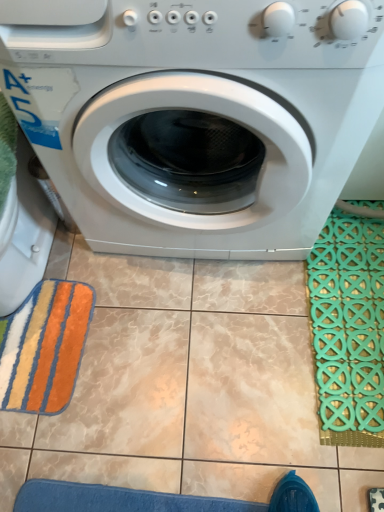
Question: Is multicolored plush bath towel at lower left further to the viewer compared to white glossy washing machine at center?

Choices:
 (A) yes
 (B) no

Answer: (A)

Question: From a real-world perspective, is multicolored plush bath towel at lower left on white glossy washing machine at center?

Choices:
 (A) yes
 (B) no

Answer: (B)

Question: Can you confirm if multicolored plush bath towel at lower left is shorter than white glossy washing machine at center?

Choices:
 (A) no
 (B) yes

Answer: (B)

Question: Considering the relative sizes of multicolored plush bath towel at lower left and white glossy washing machine at center in the image provided, is multicolored plush bath towel at lower left wider than white glossy washing machine at center?

Choices:
 (A) no
 (B) yes

Answer: (A)

Question: Considering the relative sizes of multicolored plush bath towel at lower left and white glossy washing machine at center in the image provided, is multicolored plush bath towel at lower left bigger than white glossy washing machine at center?

Choices:
 (A) yes
 (B) no

Answer: (B)

Question: Is point (49, 280) closer or farther from the camera than point (382, 293)?

Choices:
 (A) farther
 (B) closer

Answer: (A)

Question: Is multicolored plush bath towel at lower left inside or outside of green rubber bath mat at right?

Choices:
 (A) outside
 (B) inside

Answer: (A)

Question: Looking at their shapes, would you say multicolored plush bath towel at lower left is wider or thinner than green rubber bath mat at right?

Choices:
 (A) wide
 (B) thin

Answer: (A)

Question: Considering the relative positions of multicolored plush bath towel at lower left and green rubber bath mat at right in the image provided, is multicolored plush bath towel at lower left to the left or to the right of green rubber bath mat at right?

Choices:
 (A) right
 (B) left

Answer: (B)

Question: In the image, is green rubber bath mat at right on the left side or the right side of white glossy washing machine at center?

Choices:
 (A) right
 (B) left

Answer: (A)

Question: Considering their positions, is green rubber bath mat at right located in front of or behind white glossy washing machine at center?

Choices:
 (A) front
 (B) behind

Answer: (B)

Question: From a real-world perspective, is green rubber bath mat at right positioned above or below white glossy washing machine at center?

Choices:
 (A) below
 (B) above

Answer: (A)

Question: Considering the positions of point (345, 366) and point (362, 101), is point (345, 366) closer or farther from the camera than point (362, 101)?

Choices:
 (A) closer
 (B) farther

Answer: (B)

Question: From the image's perspective, is white glossy washing machine at center positioned above or below green rubber bath mat at right?

Choices:
 (A) below
 (B) above

Answer: (B)

Question: Considering the positions of white glossy washing machine at center and green rubber bath mat at right in the image, is white glossy washing machine at center taller or shorter than green rubber bath mat at right?

Choices:
 (A) tall
 (B) short

Answer: (A)